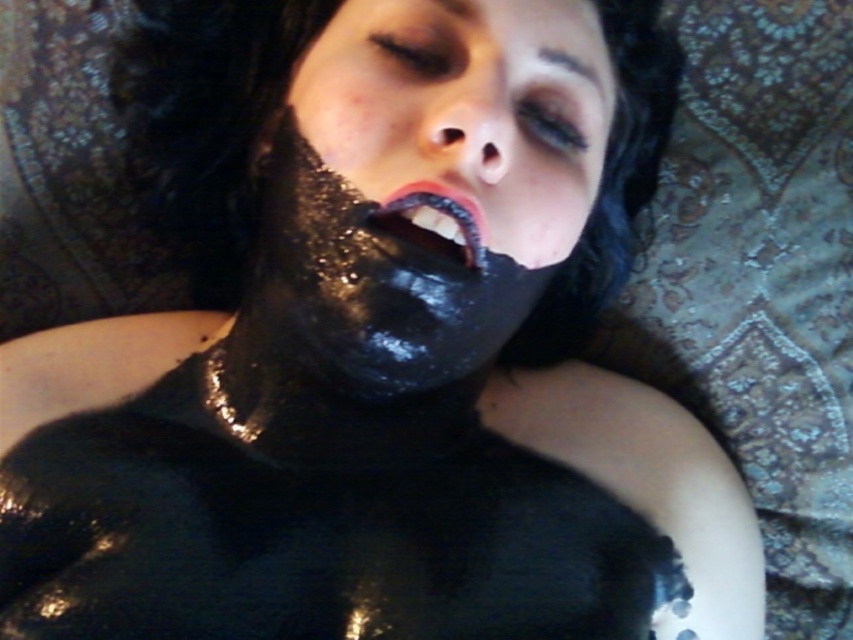
Can you confirm if black matte mask at center is positioned above shiny black lips at center?

Yes.

In the scene shown: Which is below, black matte mask at center or shiny black lips at center?

shiny black lips at center is below.

Between point (428, 36) and point (402, 195), which one is positioned behind?

Point (428, 36)

Locate an element on the screen. black matte mask at center is located at coordinates (463, 116).